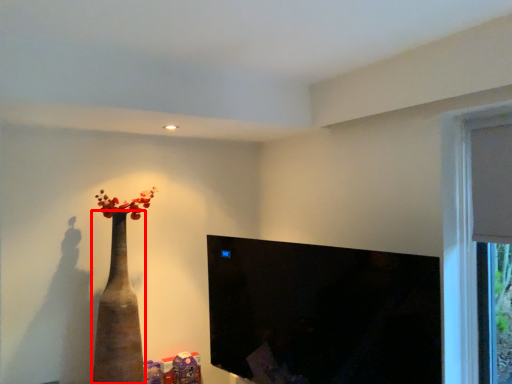
Question: From the image, what is the correct spatial relationship of vase (annotated by the red box) in relation to window screen?

Choices:
 (A) left
 (B) right

Answer: (A)